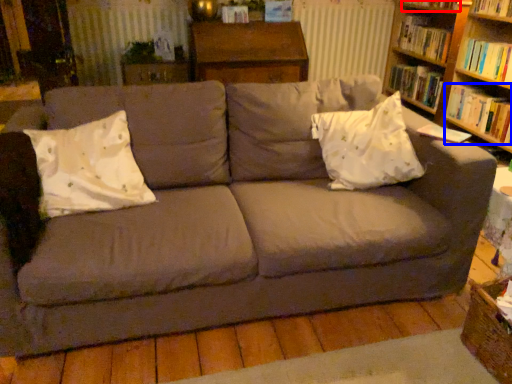
Question: Among these objects, which one is nearest to the camera, book (highlighted by a red box) or book (highlighted by a blue box)?

Choices:
 (A) book
 (B) book

Answer: (B)